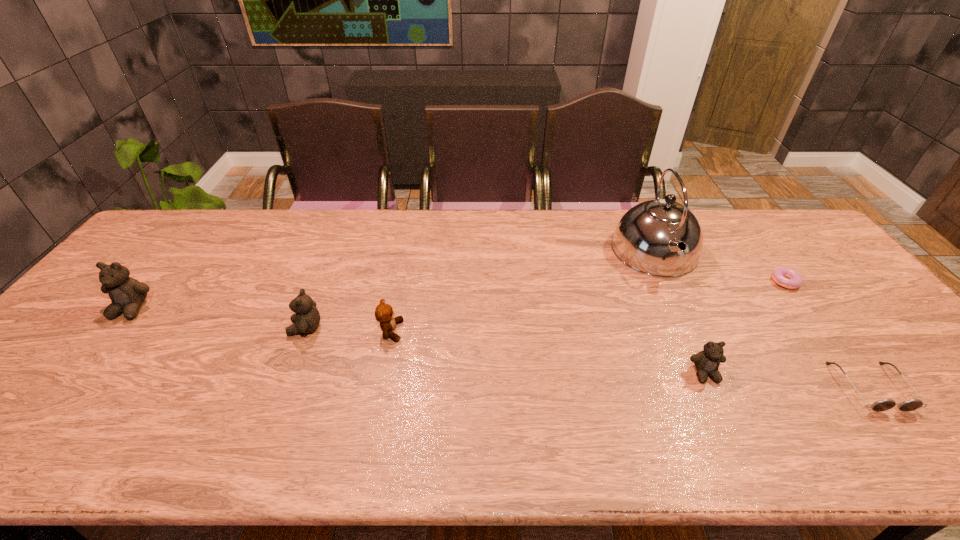
The width and height of the screenshot is (960, 540). Find the location of `blank region between the shortest object and the nearest teddy bear`. blank region between the shortest object and the nearest teddy bear is located at coordinates (744, 327).

The width and height of the screenshot is (960, 540). Identify the location of free space between the third teddy bear from left to right and the sixth tallest object. (631, 359).

At what (x,y) coordinates should I click in order to perform the action: click on free space that is in between the shortest object and the tallest object. Please return your answer as a coordinate pair (x, y). Looking at the image, I should click on (719, 266).

Find the location of a particular element. The height and width of the screenshot is (540, 960). free space between the rightmost teddy bear and the leftmost teddy bear is located at coordinates (419, 341).

Locate an element on the screen. This screenshot has height=540, width=960. empty space between the nearest teddy bear and the second tallest object is located at coordinates (419, 341).

At what (x,y) coordinates should I click in order to perform the action: click on free space between the doughnut and the nearest teddy bear. Please return your answer as a coordinate pair (x, y). Looking at the image, I should click on (744, 327).

At what (x,y) coordinates should I click in order to perform the action: click on free area in between the kettle and the nearest teddy bear. Please return your answer as a coordinate pair (x, y). This screenshot has height=540, width=960. Looking at the image, I should click on (681, 313).

You are a GUI agent. You are given a task and a screenshot of the screen. Output one action in this format:
    pyautogui.click(x=<x>, y=<y>)
    Task: Click on the empty location between the doughnut and the second teddy bear from right to left
    The width and height of the screenshot is (960, 540).
    Given the screenshot: What is the action you would take?
    pyautogui.click(x=588, y=306)

Where is `object that can be found as the second closest to the leftmost object`? object that can be found as the second closest to the leftmost object is located at coordinates [384, 314].

Locate an element on the screen. The image size is (960, 540). object that stands as the second closest to the third object from left to right is located at coordinates (127, 294).